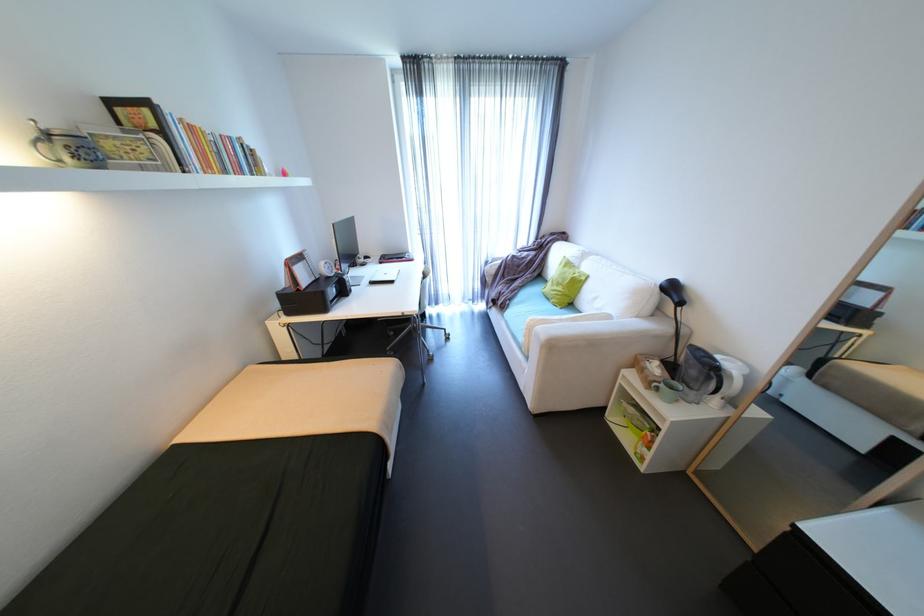
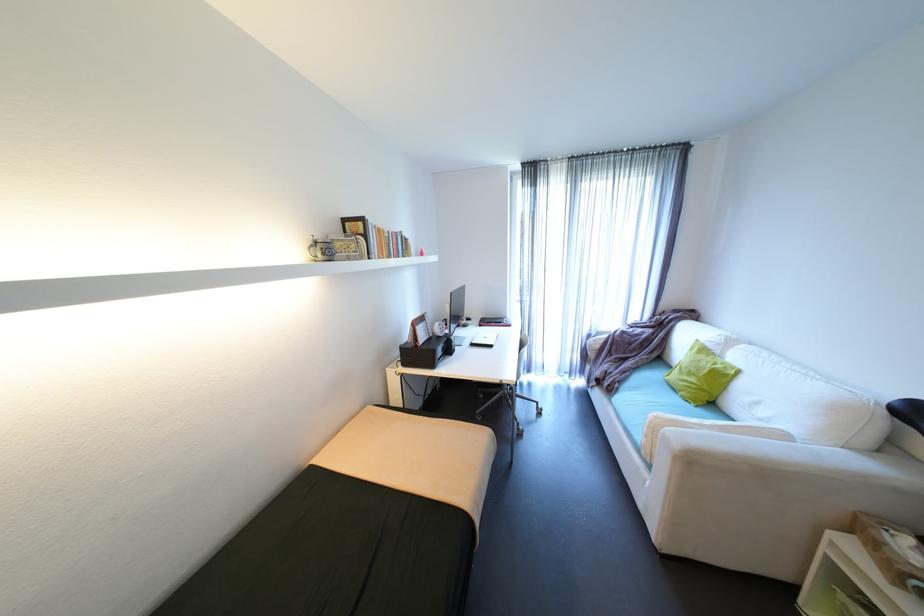
Question: The camera is either moving clockwise (left) or counter-clockwise (right) around the object. The first image is from the beginning of the video and the second image is from the end. Is the camera moving left or right when shooting the video?

Choices:
 (A) Left
 (B) Right

Answer: (B)